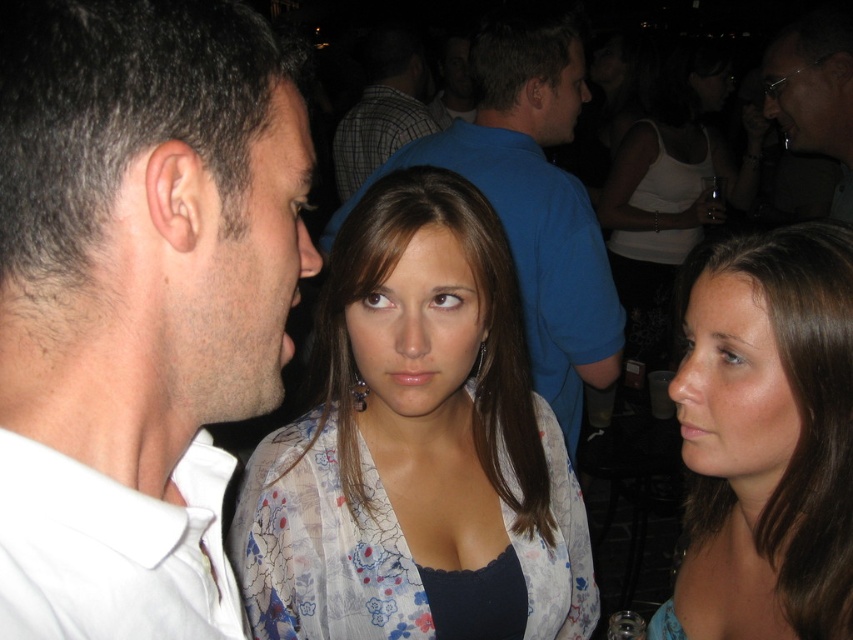
Is point (202, 20) positioned behind point (229, 570)?

No, it is in front of (229, 570).

Is point (51, 496) positioned in front of point (204, 621)?

Yes, it is in front of point (204, 621).

Find the location of a particular element. white matte shirt at center is located at coordinates (137, 305).

Which is more to the left, white matte shirt at center or plaid shirt at center?

From the viewer's perspective, plaid shirt at center appears more on the left side.

Who is taller, white matte shirt at center or plaid shirt at center?

plaid shirt at center is taller.

Is point (56, 81) positioned before point (368, 61)?

Yes, it is in front of point (368, 61).

You are a GUI agent. You are given a task and a screenshot of the screen. Output one action in this format:
    pyautogui.click(x=<x>, y=<y>)
    Task: Click on the white matte shirt at center
    Image resolution: width=853 pixels, height=640 pixels.
    Given the screenshot: What is the action you would take?
    pyautogui.click(x=137, y=305)

Between white matte tank top at upper center and sunglasses at upper right, which one is positioned higher?

Positioned higher is white matte tank top at upper center.

Image resolution: width=853 pixels, height=640 pixels. In order to click on white matte tank top at upper center in this screenshot , I will do `click(669, 195)`.